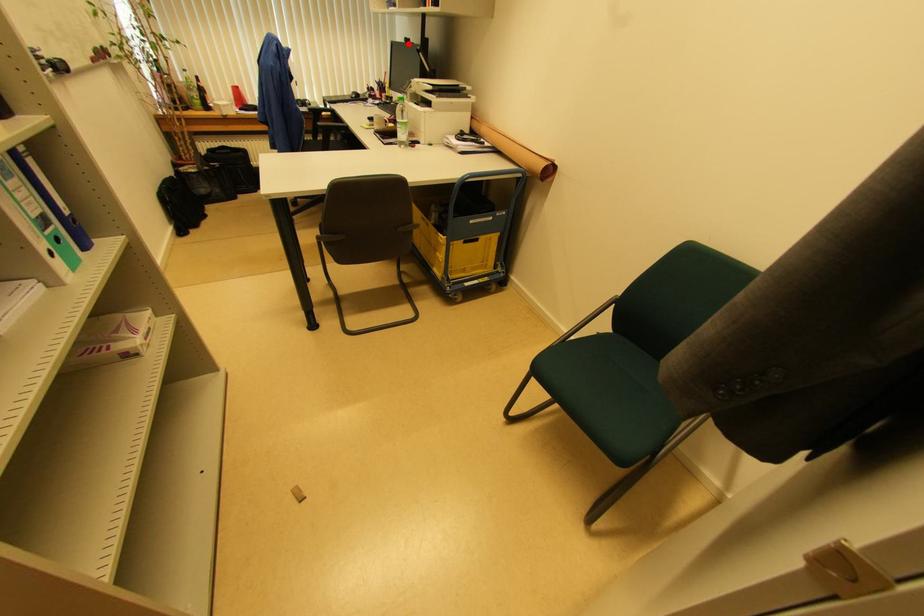
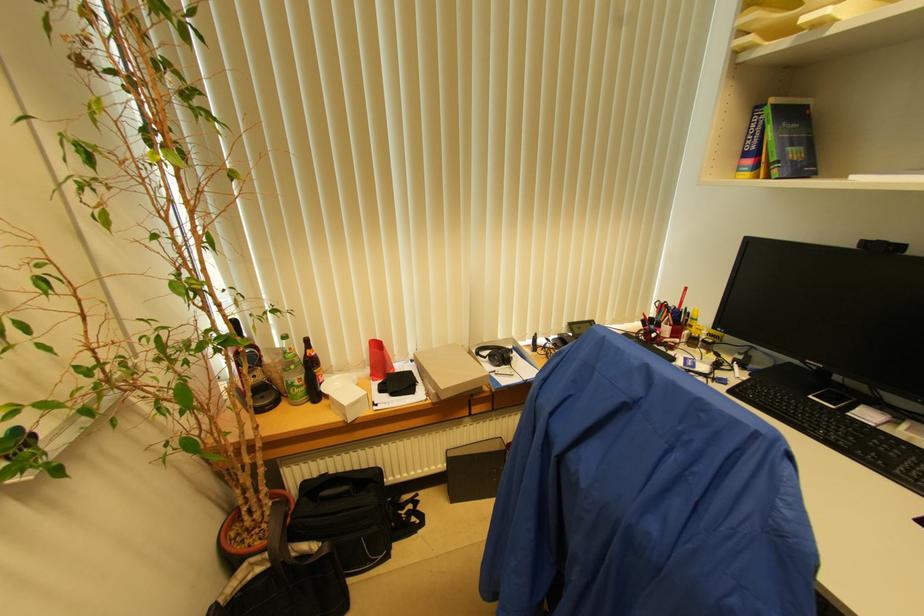
Question: I am providing you with two images of the same scene from different viewpoints. Given a red point in image1, look at the same physical point in image2. Is it:

Choices:
 (A) Closer to the viewpoint
 (B) Farther from the viewpoint

Answer: (B)